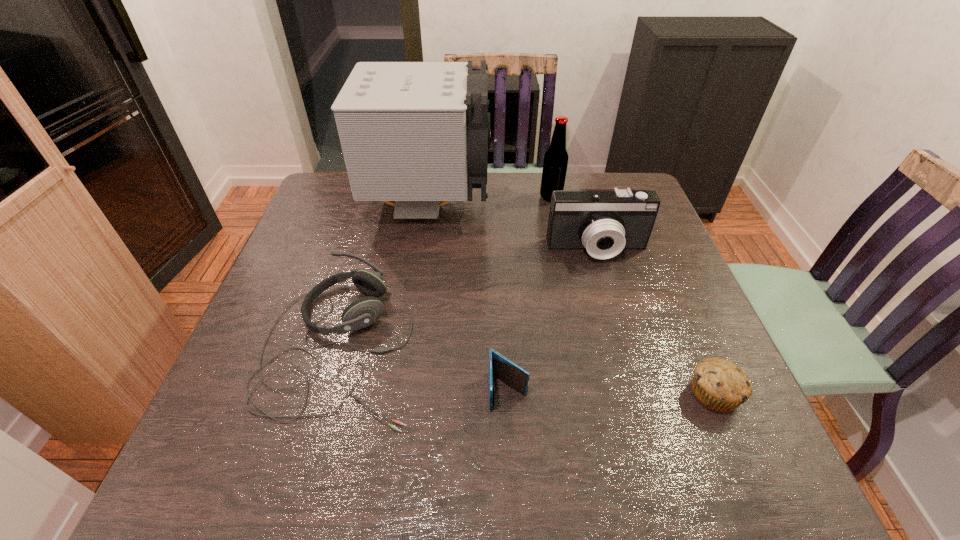
At what (x,y) coordinates should I click in order to perform the action: click on fan. Please return your answer as a coordinate pair (x, y). Looking at the image, I should click on (418, 133).

This screenshot has width=960, height=540. I want to click on the fifth shortest object, so click(555, 163).

The height and width of the screenshot is (540, 960). In order to click on the fourth shortest object in this screenshot , I will do `click(604, 222)`.

Where is `headset`? This screenshot has width=960, height=540. headset is located at coordinates point(363,312).

You are a GUI agent. You are given a task and a screenshot of the screen. Output one action in this format:
    pyautogui.click(x=<x>, y=<y>)
    Task: Click on the muffin
    
    Given the screenshot: What is the action you would take?
    pyautogui.click(x=719, y=385)

You are a GUI agent. You are given a task and a screenshot of the screen. Output one action in this format:
    pyautogui.click(x=<x>, y=<y>)
    Task: Click on the wallet
    
    Given the screenshot: What is the action you would take?
    pyautogui.click(x=508, y=372)

Where is `free spot located 0.390m on the front of the fan`? free spot located 0.390m on the front of the fan is located at coordinates (408, 350).

Where is `vacant space located 0.060m on the left of the fifth shortest object`? vacant space located 0.060m on the left of the fifth shortest object is located at coordinates (520, 197).

At what (x,y) coordinates should I click in order to perform the action: click on free space located on the lens of the camcorder. Please return your answer as a coordinate pair (x, y). The width and height of the screenshot is (960, 540). Looking at the image, I should click on (606, 280).

The height and width of the screenshot is (540, 960). I want to click on free space located 0.170m on the outer surface of the fourth tallest object, so pos(495,345).